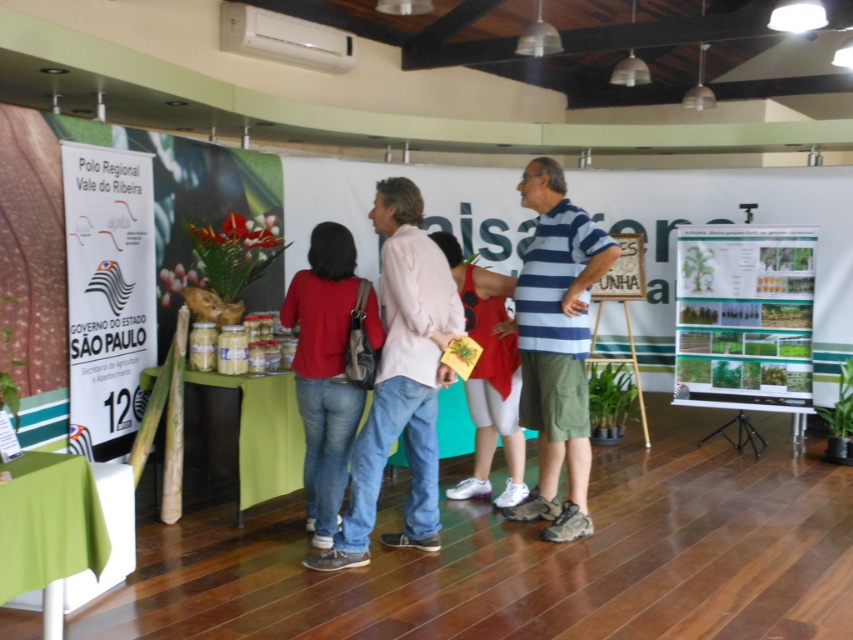
From the picture: Does matte red shirt at center have a smaller size compared to white fabric dress at center?

Yes.

Does matte red shirt at center appear under white fabric dress at center?

Yes.

Between point (341, 243) and point (476, 330), which one is positioned behind?

Positioned behind is point (476, 330).

Where is `matte red shirt at center`? The image size is (853, 640). matte red shirt at center is located at coordinates (323, 372).

Can you confirm if denim jeans at center is positioned below matte red shirt at center?

Incorrect, denim jeans at center is not positioned below matte red shirt at center.

Between denim jeans at center and matte red shirt at center, which one has less height?

Standing shorter between the two is matte red shirt at center.

What do you see at coordinates (401, 380) in the screenshot? I see `denim jeans at center` at bounding box center [401, 380].

The image size is (853, 640). I want to click on denim jeans at center, so click(401, 380).

Is point (395, 240) more distant than point (729, 234)?

No, (395, 240) is in front of (729, 234).

Which is in front, point (438, 257) or point (726, 333)?

Point (438, 257) is more forward.

Which is in front, point (422, 536) or point (804, 241)?

Point (422, 536) is in front.

Find the location of a particular element. The width and height of the screenshot is (853, 640). denim jeans at center is located at coordinates (401, 380).